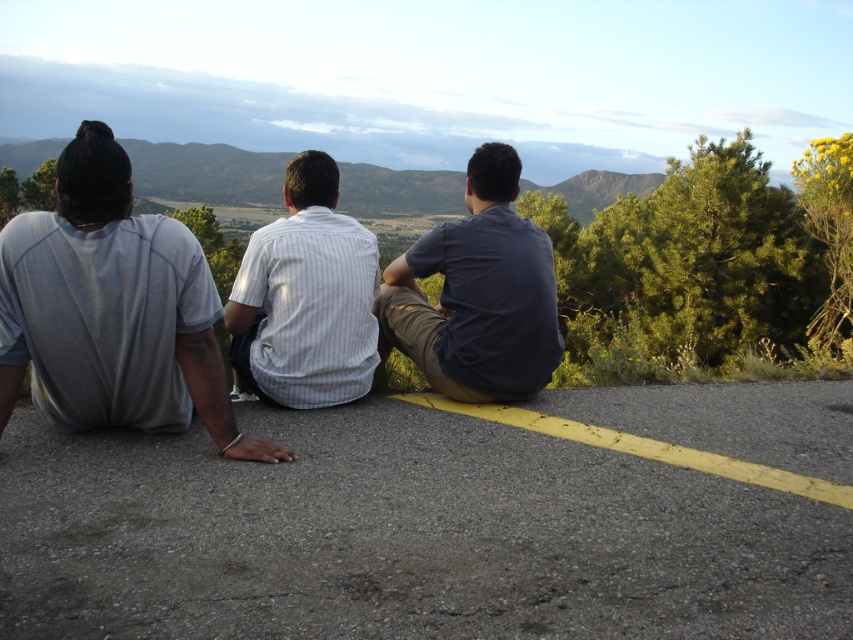
Is gray cotton t-shirt at left to the right of dark blue shirt at center from the viewer's perspective?

In fact, gray cotton t-shirt at left is to the left of dark blue shirt at center.

Can you confirm if gray cotton t-shirt at left is positioned below dark blue shirt at center?

Yes, gray cotton t-shirt at left is below dark blue shirt at center.

Which is behind, point (173, 257) or point (467, 275)?

Positioned behind is point (467, 275).

This screenshot has height=640, width=853. Identify the location of gray cotton t-shirt at left. (112, 310).

Does dark blue shirt at center have a greater height compared to white striped shirt at center?

No.

Identify the location of dark blue shirt at center. (479, 292).

In the scene shown: Who is higher up, gray cotton t-shirt at left or white striped shirt at center?

white striped shirt at center

Is gray cotton t-shirt at left above white striped shirt at center?

Actually, gray cotton t-shirt at left is below white striped shirt at center.

Locate an element on the screen. The height and width of the screenshot is (640, 853). gray cotton t-shirt at left is located at coordinates (112, 310).

What are the coordinates of `gray cotton t-shirt at left` in the screenshot? It's located at (x=112, y=310).